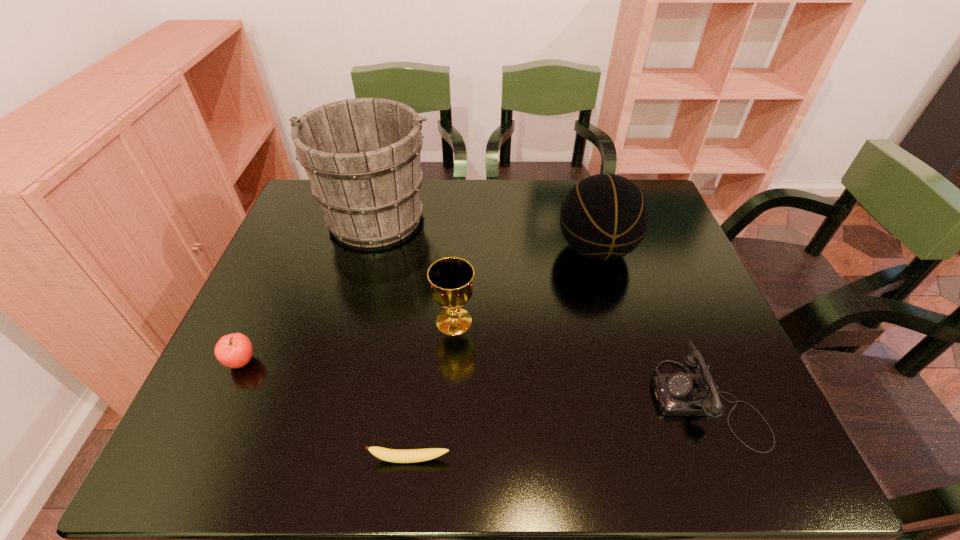
This screenshot has height=540, width=960. Identify the location of vacant point located on the front-facing side of the telephone. (534, 400).

Locate an element on the screen. This screenshot has height=540, width=960. free region located on the front-facing side of the telephone is located at coordinates click(524, 400).

Find the location of a particular element. This screenshot has height=540, width=960. vacant point located on the front-facing side of the telephone is located at coordinates (539, 400).

Locate an element on the screen. Image resolution: width=960 pixels, height=540 pixels. object at the far edge is located at coordinates (362, 156).

You are a GUI agent. You are given a task and a screenshot of the screen. Output one action in this format:
    pyautogui.click(x=<x>, y=<y>)
    Task: Click on the telephone that is at the near edge
    This screenshot has height=540, width=960.
    Given the screenshot: What is the action you would take?
    pyautogui.click(x=677, y=394)

Identify the location of banana that is at the near edge. (391, 455).

Find the location of a particular element. Image resolution: width=960 pixels, height=540 pixels. bucket present at the left edge is located at coordinates (362, 156).

Locate an element on the screen. This screenshot has width=960, height=540. apple present at the left edge is located at coordinates (234, 350).

What are the coordinates of `basketball present at the right edge` in the screenshot? It's located at (604, 217).

Where is `telephone located in the right edge section of the desktop`? This screenshot has width=960, height=540. telephone located in the right edge section of the desktop is located at coordinates (677, 394).